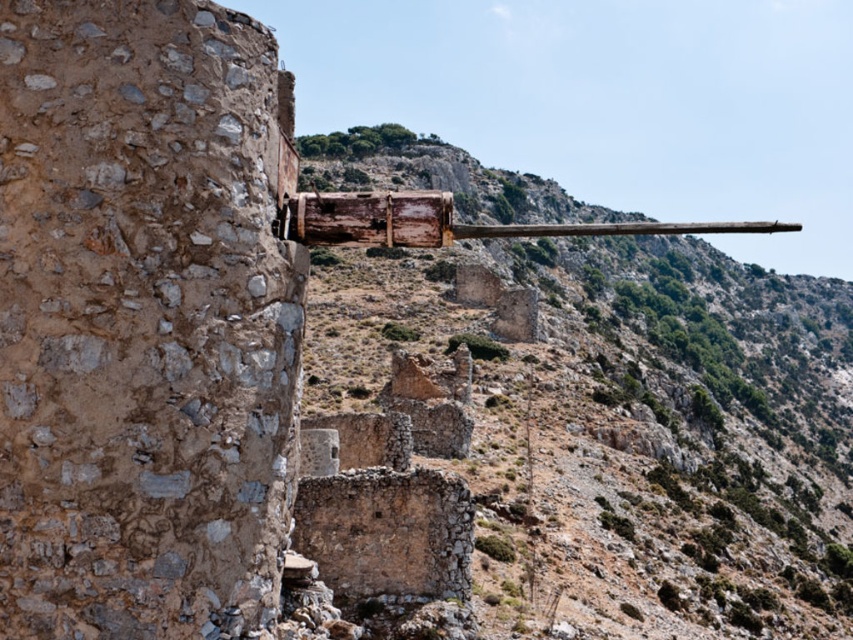
You are standing in front of the rustic stone wall at left and the rusty wood cannon at center. Which object is positioned higher from the ground?

The rusty wood cannon at center is positioned higher from the ground than the rustic stone wall at left because the rustic stone wall at left is located below the rusty wood cannon at center.

You are standing in the middle of the arid landscape and want to take a photo of the rustic stone wall at left. Where should you position yourself to capture it in your camera frame?

To capture the rustic stone wall at left in your camera frame, position yourself so that the camera is aimed at the coordinates specified by the point where the rustic stone wall at left is located, which is at point (142, 321).